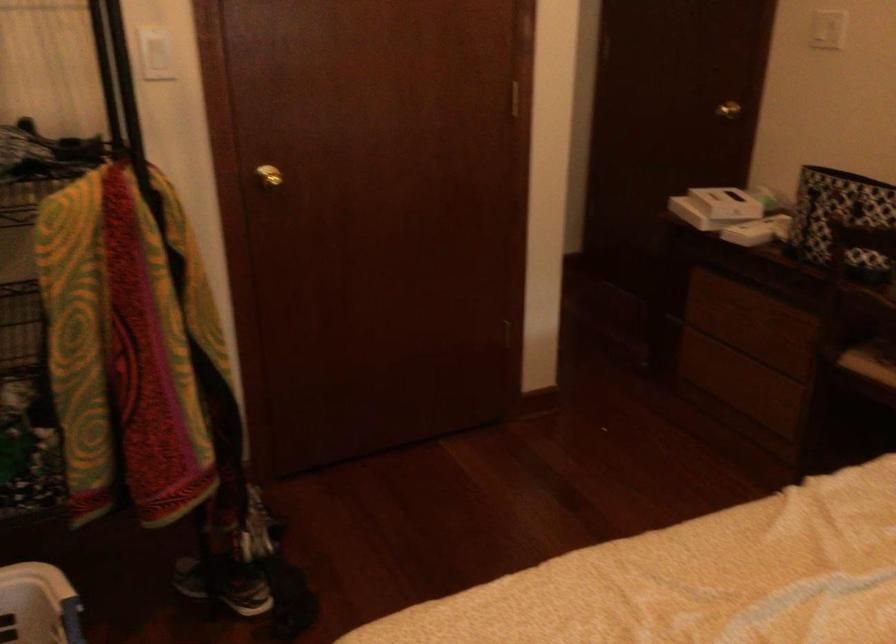
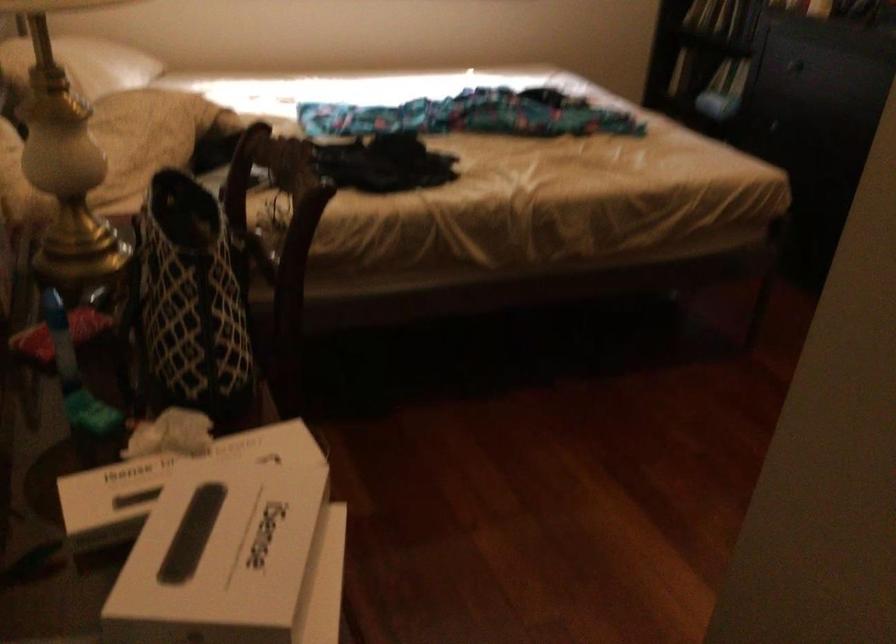
The point at (745, 196) is marked in the first image. Where is the corresponding point in the second image?

(168, 477)